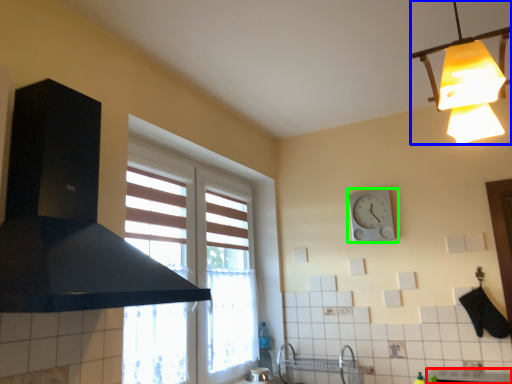
Question: Which object is positioned farthest from counter top (highlighted by a red box)? Select from lamp (highlighted by a blue box) and wall clock (highlighted by a green box).

Choices:
 (A) lamp
 (B) wall clock

Answer: (A)